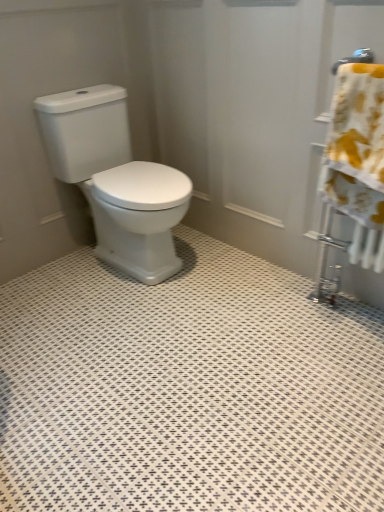
Find the location of a particular element. The width and height of the screenshot is (384, 512). spots to the right of white glossy toilet at center is located at coordinates (228, 269).